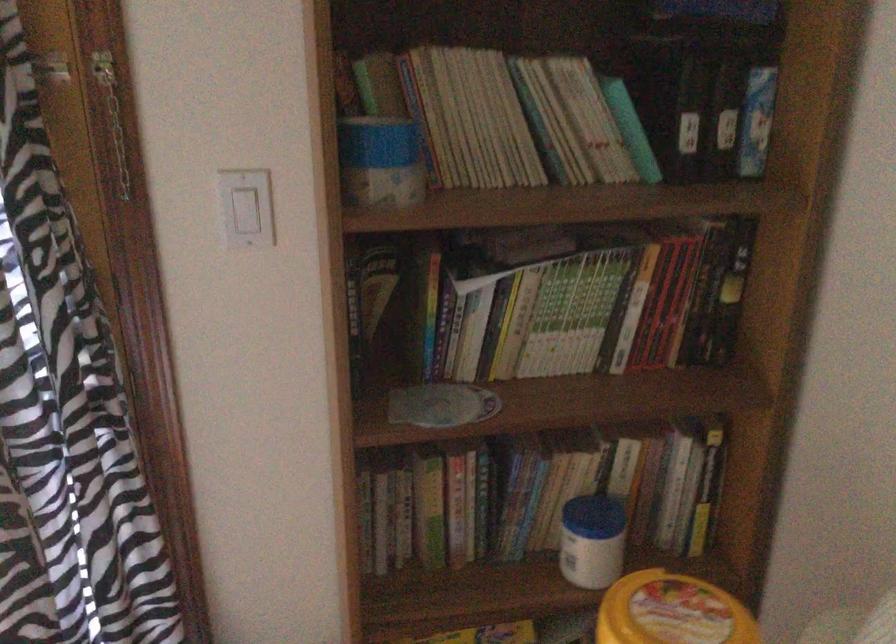
Where is `orange container lid`? orange container lid is located at coordinates click(x=672, y=612).